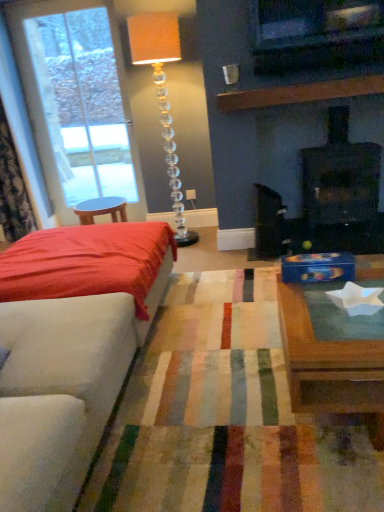
Question: Based on their sizes in the image, would you say translucent crystal floor lamp at center is bigger or smaller than black matte fireplace at upper right?

Choices:
 (A) small
 (B) big

Answer: (A)

Question: Does point (167, 114) appear closer or farther from the camera than point (311, 216)?

Choices:
 (A) closer
 (B) farther

Answer: (B)

Question: Considering the real-world distances, which object is farthest from the satin red bed at left?

Choices:
 (A) wooden coffee table at center
 (B) velvet floral curtain at left
 (C) clear glass door at left
 (D) translucent crystal floor lamp at center
 (E) black matte fireplace at upper right

Answer: (B)

Question: Considering the real-world distances, which object is closest to the translucent crystal floor lamp at center?

Choices:
 (A) wooden coffee table at center
 (B) satin red bed at left
 (C) black matte fireplace at upper right
 (D) clear glass door at left
 (E) velvet floral curtain at left

Answer: (D)